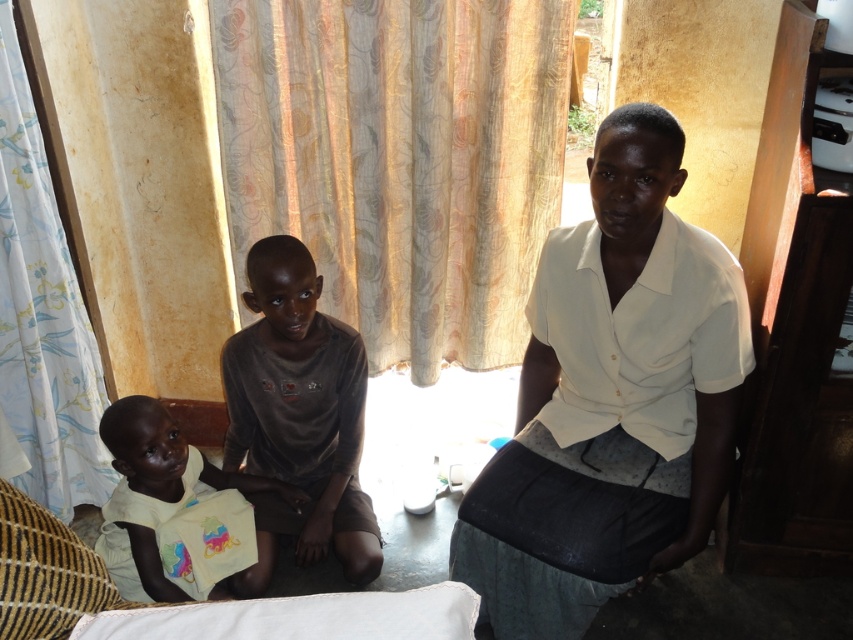
Question: Which point is closer to the camera?

Choices:
 (A) white floral fabric curtain at left
 (B) light beige sheer curtain at center

Answer: (A)

Question: Does white matte shirt at center come behind light yellow fabric at lower left?

Choices:
 (A) yes
 (B) no

Answer: (B)

Question: From the image, what is the correct spatial relationship of light beige sheer curtain at center in relation to white floral fabric curtain at left?

Choices:
 (A) right
 (B) left

Answer: (A)

Question: Among these points, which one is nearest to the camera?

Choices:
 (A) (201, 524)
 (B) (590, 508)
 (C) (300, 218)

Answer: (B)

Question: Can you confirm if white matte shirt at center is positioned to the right of light yellow fabric at lower left?

Choices:
 (A) yes
 (B) no

Answer: (A)

Question: Which object is closer to the camera taking this photo?

Choices:
 (A) light beige sheer curtain at center
 (B) white floral fabric curtain at left

Answer: (B)